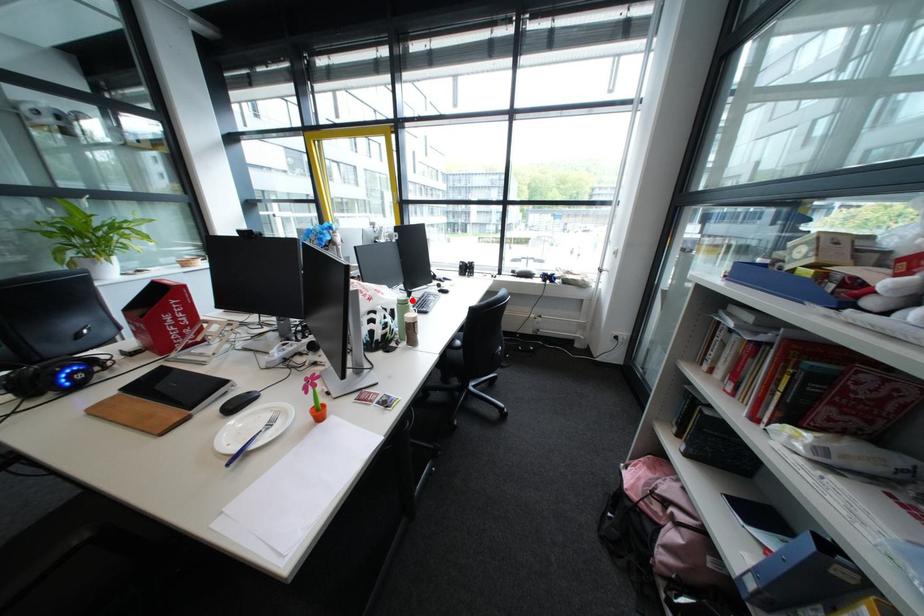
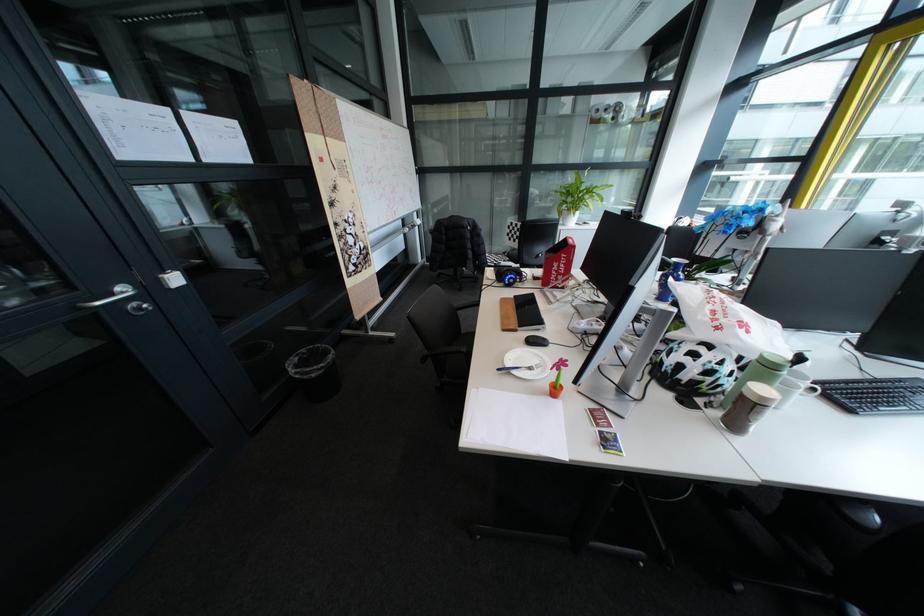
Question: I am providing you with two images of the same scene from different viewpoints. Given a red point in image1, look at the same physical point in image2. Is it:

Choices:
 (A) Closer to the viewpoint
 (B) Farther from the viewpoint

Answer: (B)